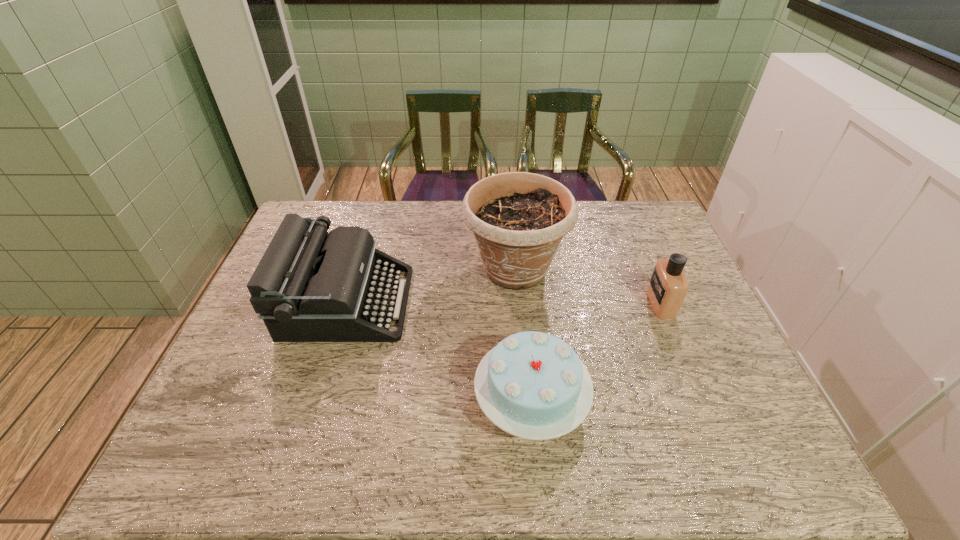
You are a GUI agent. You are given a task and a screenshot of the screen. Output one action in this format:
    pyautogui.click(x=<x>, y=<y>)
    Task: Click on the vacant area situated 0.280m on the back of the birthday cake
    This screenshot has width=960, height=540.
    Given the screenshot: What is the action you would take?
    pyautogui.click(x=519, y=280)

Find the location of a particular element. object located in the far edge section of the desktop is located at coordinates (518, 218).

Locate an element on the screen. The width and height of the screenshot is (960, 540). object present at the near edge is located at coordinates (533, 385).

This screenshot has width=960, height=540. I want to click on object at the left edge, so 310,286.

The height and width of the screenshot is (540, 960). Find the location of `object at the right edge`. object at the right edge is located at coordinates (668, 286).

This screenshot has width=960, height=540. Find the location of `vacant space at the far edge of the desktop`. vacant space at the far edge of the desktop is located at coordinates (367, 224).

In order to click on vacant space at the left edge in this screenshot , I will do `click(228, 409)`.

Where is `free spot at the right edge of the desktop`? The height and width of the screenshot is (540, 960). free spot at the right edge of the desktop is located at coordinates (655, 242).

Find the location of a particular element. The image size is (960, 540). free space at the near left corner of the desktop is located at coordinates (x=199, y=439).

At what (x,y) coordinates should I click in order to perform the action: click on vacant area that lies between the perfume and the birthday cake. Please return your answer as a coordinate pair (x, y). This screenshot has width=960, height=540. Looking at the image, I should click on (596, 352).